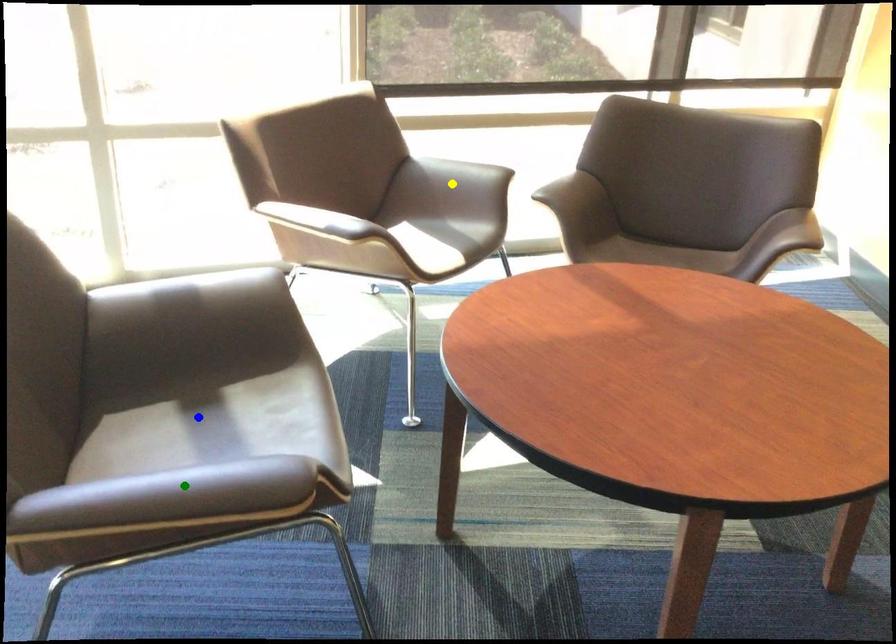
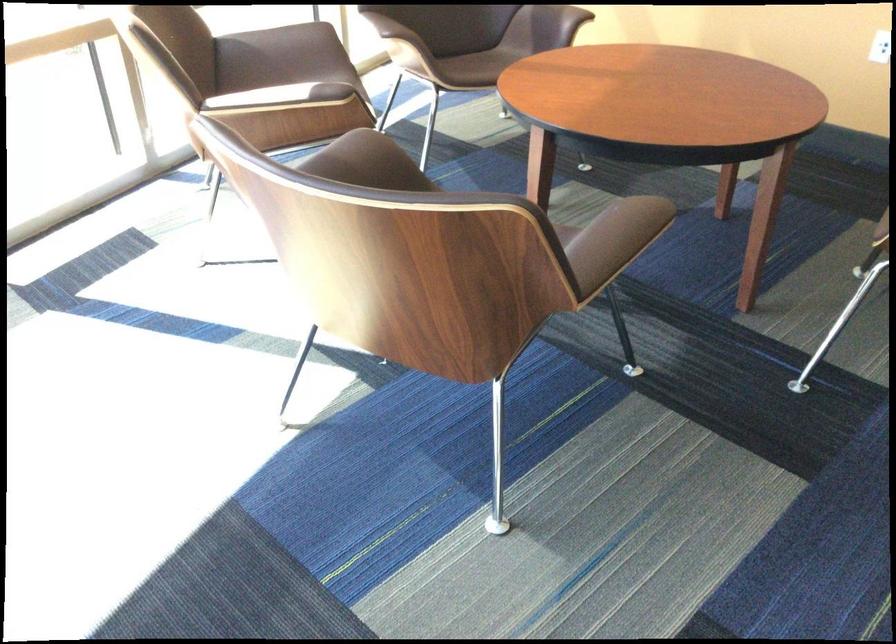
I am providing you with two images of the same scene from different viewpoints. Three points are marked in image1. Which point corresponds to a part or object that is occluded in image2?In image1, three points are marked. Which of them correspond to a part or object that is occluded in image2?Among the three points shown in image1, which one corresponds to a part or object that is no longer visible due to occlusion in image2?

blue point